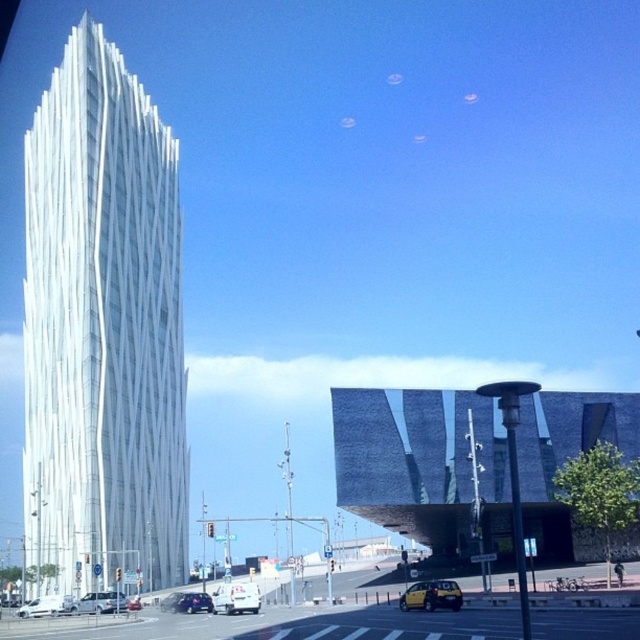
Question: Which point is farther to the camera?

Choices:
 (A) (408, 604)
 (B) (225, 593)
 (C) (96, 221)
 (D) (184, 600)

Answer: (C)

Question: Does yellow matte taxi at lower center appear on the left side of white matte van at lower left?

Choices:
 (A) yes
 (B) no

Answer: (B)

Question: Does white matte van at center appear on the right side of white matte van at lower left?

Choices:
 (A) yes
 (B) no

Answer: (A)

Question: Which point is farther to the camera?

Choices:
 (A) (24, 486)
 (B) (179, 608)
 (C) (259, 602)
 (D) (19, 611)

Answer: (A)

Question: Is white glass skyscraper at left closer to the viewer compared to white matte van at center?

Choices:
 (A) no
 (B) yes

Answer: (A)

Question: Which point is closer to the camera?

Choices:
 (A) metallic silver sedan at center
 (B) yellow matte taxi at lower center
 (C) white matte van at center

Answer: (B)